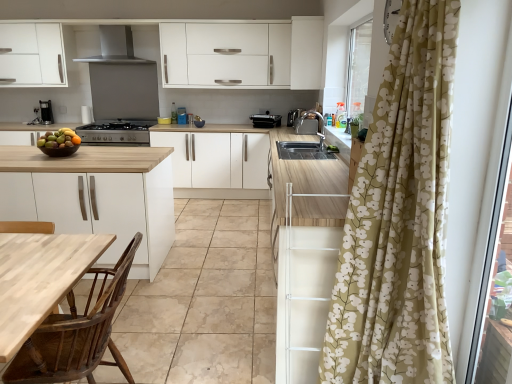
Question: Is wooden at left thinner than satin silver toaster at upper center, which is the second appliance from left to right?

Choices:
 (A) yes
 (B) no

Answer: (B)

Question: From the image's perspective, is wooden at left above satin silver toaster at upper center, which is the second appliance from left to right?

Choices:
 (A) yes
 (B) no

Answer: (B)

Question: Would you say wooden at left is outside satin silver toaster at upper center, which is the second appliance from left to right?

Choices:
 (A) no
 (B) yes

Answer: (B)

Question: Considering the relative positions of wooden at left and satin silver toaster at upper center, the 1th appliance positioned from the right, in the image provided, is wooden at left to the right of satin silver toaster at upper center, the 1th appliance positioned from the right, from the viewer's perspective?

Choices:
 (A) no
 (B) yes

Answer: (A)

Question: From the image's perspective, is wooden at left below satin silver toaster at upper center, which is the second appliance from left to right?

Choices:
 (A) no
 (B) yes

Answer: (B)

Question: Is wooden at left turned away from satin silver toaster at upper center, which is the second appliance from left to right?

Choices:
 (A) yes
 (B) no

Answer: (B)

Question: Is black plastic toaster at center, which appears as the 1th appliance when viewed from the left, at the right side of white matte cabinet at upper center, which appears as the 1th cabinetry when viewed from the top?

Choices:
 (A) yes
 (B) no

Answer: (B)

Question: Is black plastic toaster at center, which appears as the 1th appliance when viewed from the left, positioned behind white matte cabinet at upper center, the 1th cabinetry viewed from the right?

Choices:
 (A) yes
 (B) no

Answer: (A)

Question: Considering the relative sizes of black plastic toaster at center, which is counted as the second appliance, starting from the right, and white matte cabinet at upper center, the second cabinetry from the left, in the image provided, is black plastic toaster at center, which is counted as the second appliance, starting from the right, smaller than white matte cabinet at upper center, the second cabinetry from the left,?

Choices:
 (A) yes
 (B) no

Answer: (A)

Question: Is black plastic toaster at center, which appears as the 1th appliance when viewed from the left, positioned beyond the bounds of white matte cabinet at upper center, the 1th cabinetry viewed from the right?

Choices:
 (A) yes
 (B) no

Answer: (A)

Question: Is black plastic toaster at center, which is counted as the second appliance, starting from the right, touching white matte cabinet at upper center, the second cabinetry from the left?

Choices:
 (A) yes
 (B) no

Answer: (B)

Question: Considering the relative sizes of black plastic toaster at center, which is counted as the second appliance, starting from the right, and white matte cabinet at upper center, the second cabinetry from the left, in the image provided, is black plastic toaster at center, which is counted as the second appliance, starting from the right, wider than white matte cabinet at upper center, the second cabinetry from the left,?

Choices:
 (A) yes
 (B) no

Answer: (A)

Question: Can you confirm if wooden polished chair at lower left is taller than shiny brown bowl at left?

Choices:
 (A) no
 (B) yes

Answer: (B)